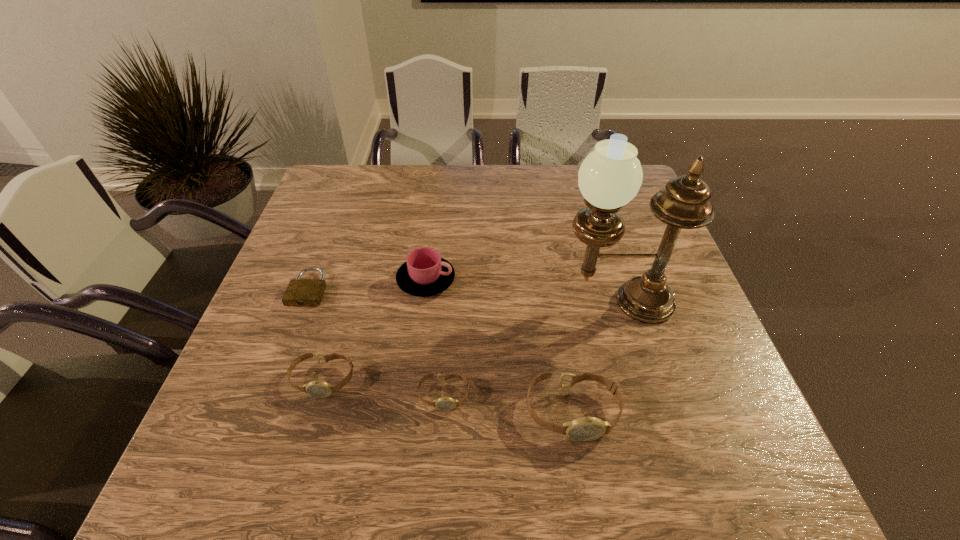
Given the evenly spaced watchs in the image, where should an extra watch be added on the right to preserve the spacing? Please point to a vacant space. Please provide its 2D coordinates. Your answer should be formatted as a tuple, i.e. [(x, y)], where the tuple contains the x and y coordinates of a point satisfying the conditions above.

[(708, 429)]